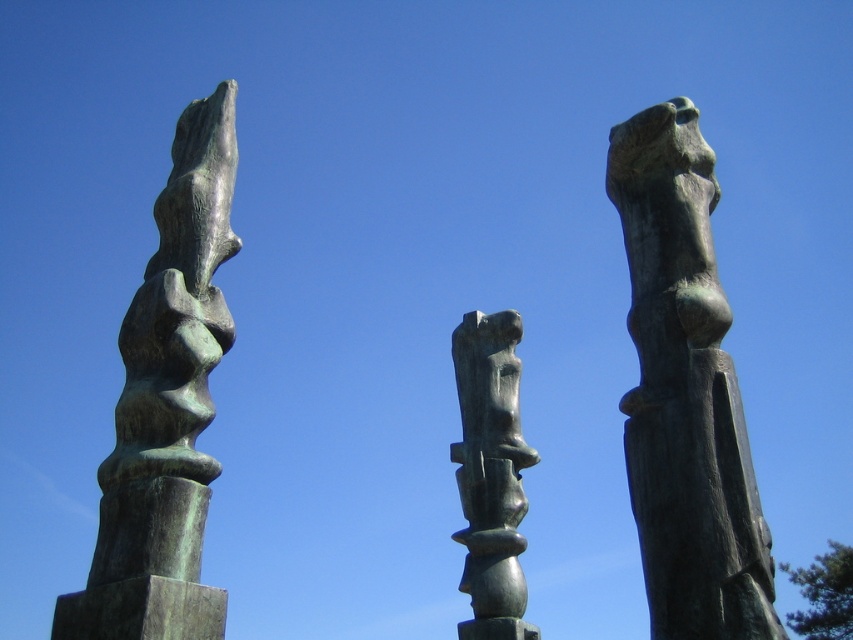
Question: Which is nearer to the green patinated stone figure at center?

Choices:
 (A) green patina sculpture at left
 (B) bronze statue at right

Answer: (B)

Question: Does bronze statue at right have a smaller size compared to green patinated stone figure at center?

Choices:
 (A) no
 (B) yes

Answer: (B)

Question: In this image, where is bronze statue at right located relative to green patinated stone figure at center?

Choices:
 (A) above
 (B) below

Answer: (A)

Question: Considering the real-world distances, which object is farthest from the green patina sculpture at left?

Choices:
 (A) green patinated stone figure at center
 (B) bronze statue at right

Answer: (A)

Question: Does bronze statue at right have a greater width compared to green patina sculpture at left?

Choices:
 (A) no
 (B) yes

Answer: (A)

Question: Which point appears closest to the camera in this image?

Choices:
 (A) (486, 552)
 (B) (662, 189)

Answer: (B)